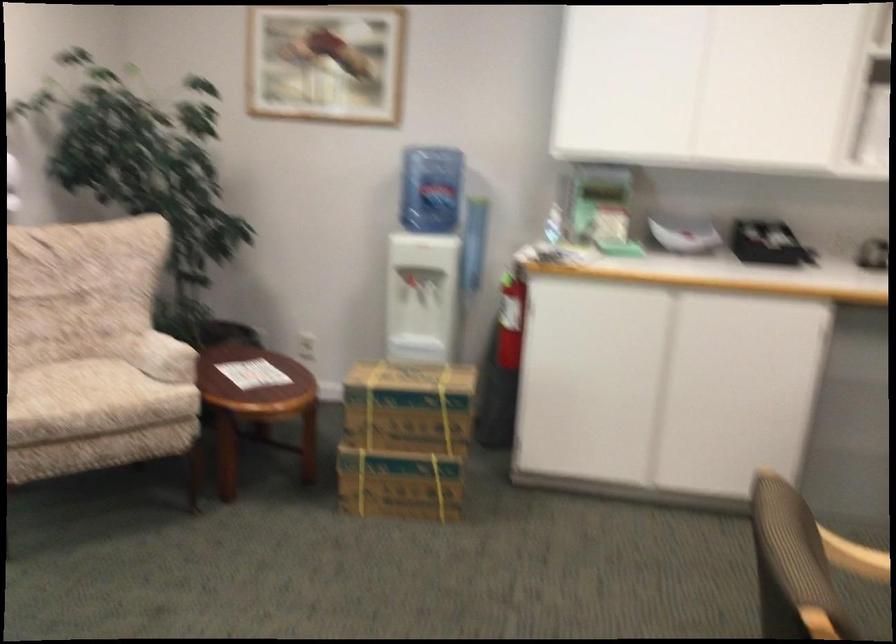
Find where to rest the chair armrest. Please return your answer as a coordinate pair (x, y).

(857, 529)